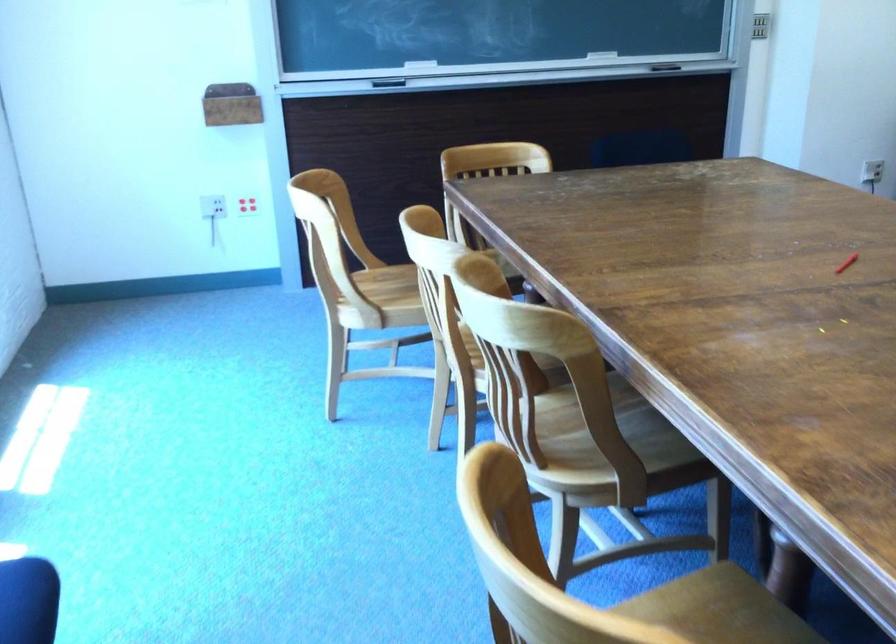
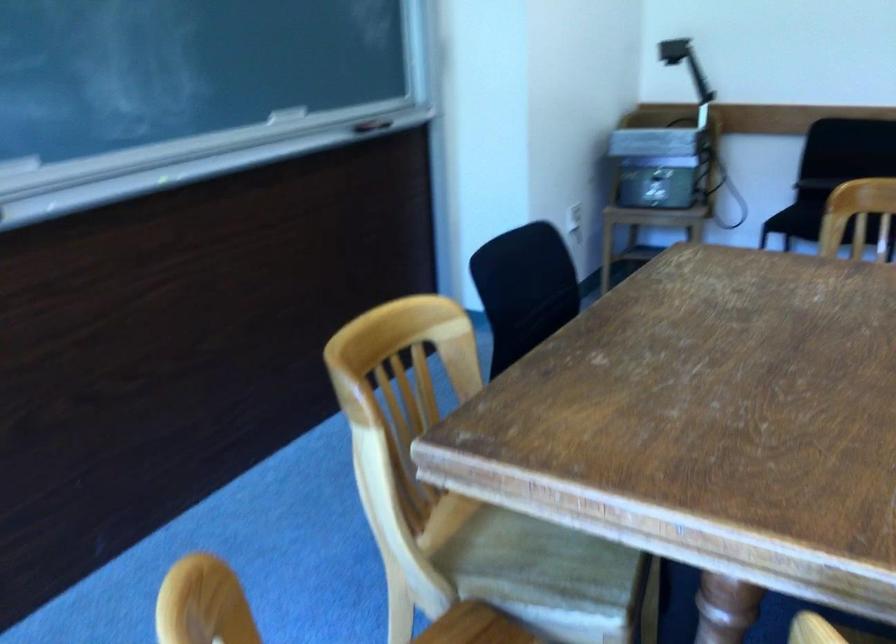
Question: I am providing you with two images of the same scene from different viewpoints. Which of the following objects are not visible in image2?

Choices:
 (A) purple clothespin
 (B) chair sitting surface
 (C) chalkboard eraser
 (D) projector head

Answer: (C)